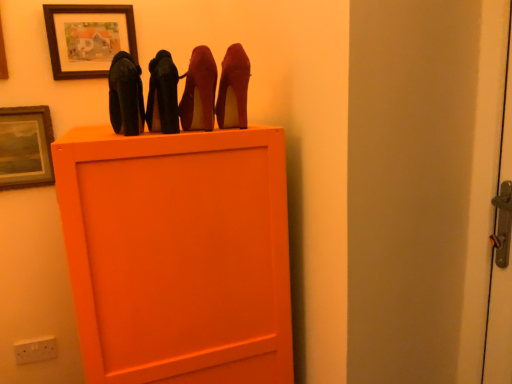
This screenshot has height=384, width=512. Find the location of `matte black high heels at upper center, the fourth high heels when ordered from right to left`. matte black high heels at upper center, the fourth high heels when ordered from right to left is located at coordinates (126, 95).

Describe the element at coordinates (199, 92) in the screenshot. The height and width of the screenshot is (384, 512). I see `shiny red high heels at upper center, acting as the 3th high heels starting from the left` at that location.

The image size is (512, 384). What do you see at coordinates (25, 147) in the screenshot? I see `wooden picture frame at upper left, the second picture frame viewed from the top` at bounding box center [25, 147].

This screenshot has height=384, width=512. What are the coordinates of `matte wooden picture frame at upper center, the 1th picture frame positioned from the top` in the screenshot? It's located at (88, 38).

Considering the sizes of white plastic electric outlet at lower left and matte wooden picture frame at upper center, the 1th picture frame in the right-to-left sequence, in the image, is white plastic electric outlet at lower left wider or thinner than matte wooden picture frame at upper center, the 1th picture frame in the right-to-left sequence,?

white plastic electric outlet at lower left is thinner than matte wooden picture frame at upper center, the 1th picture frame in the right-to-left sequence.

In the scene shown: Which object is closer to the camera taking this photo, white plastic electric outlet at lower left or matte wooden picture frame at upper center, which is counted as the 2th picture frame, starting from the left?

Positioned in front is matte wooden picture frame at upper center, which is counted as the 2th picture frame, starting from the left.

Which of these two, white plastic electric outlet at lower left or matte wooden picture frame at upper center, the 1th picture frame positioned from the top, is bigger?

Bigger between the two is matte wooden picture frame at upper center, the 1th picture frame positioned from the top.

From a real-world perspective, is white plastic electric outlet at lower left physically located above or below matte wooden picture frame at upper center, the 1th picture frame in the right-to-left sequence?

Clearly, from a real-world perspective, white plastic electric outlet at lower left is below matte wooden picture frame at upper center, the 1th picture frame in the right-to-left sequence.

From the picture: Is suede-like red high heels at upper center, acting as the fourth high heels starting from the left, smaller than matte wooden picture frame at upper center, which is counted as the 2th picture frame, starting from the left?

Actually, suede-like red high heels at upper center, acting as the fourth high heels starting from the left, might be larger than matte wooden picture frame at upper center, which is counted as the 2th picture frame, starting from the left.

Can you confirm if suede-like red high heels at upper center, acting as the fourth high heels starting from the left, is thinner than matte wooden picture frame at upper center, which is counted as the 2th picture frame, starting from the left?

Incorrect, the width of suede-like red high heels at upper center, acting as the fourth high heels starting from the left, is not less than that of matte wooden picture frame at upper center, which is counted as the 2th picture frame, starting from the left.

In the scene shown: From a real-world perspective, is suede-like red high heels at upper center, acting as the fourth high heels starting from the left, positioned under matte wooden picture frame at upper center, the 1th picture frame in the right-to-left sequence, based on gravity?

Indeed, from a real-world perspective, suede-like red high heels at upper center, acting as the fourth high heels starting from the left, is positioned beneath matte wooden picture frame at upper center, the 1th picture frame in the right-to-left sequence.

Is suede-like red high heels at upper center, acting as the fourth high heels starting from the left, at the right side of matte wooden picture frame at upper center, which is counted as the 2th picture frame, starting from the left?

Yes, suede-like red high heels at upper center, acting as the fourth high heels starting from the left, is to the right of matte wooden picture frame at upper center, which is counted as the 2th picture frame, starting from the left.

Is white plastic electric outlet at lower left smaller than shiny black high heels at center, the second high heels positioned from the left?

Yes, white plastic electric outlet at lower left is smaller than shiny black high heels at center, the second high heels positioned from the left.

How far apart are white plastic electric outlet at lower left and shiny black high heels at center, the second high heels positioned from the left?

A distance of 3.90 feet exists between white plastic electric outlet at lower left and shiny black high heels at center, the second high heels positioned from the left.

Is white plastic electric outlet at lower left not within shiny black high heels at center, acting as the third high heels starting from the right?

That's correct, white plastic electric outlet at lower left is outside of shiny black high heels at center, acting as the third high heels starting from the right.

Based on the photo, is the depth of white plastic electric outlet at lower left greater than that of shiny black high heels at center, acting as the third high heels starting from the right?

Yes, white plastic electric outlet at lower left is further from the camera.

Is suede-like red high heels at upper center, acting as the fourth high heels starting from the left, turned away from white plastic electric outlet at lower left?

No, suede-like red high heels at upper center, acting as the fourth high heels starting from the left,'s orientation is not away from white plastic electric outlet at lower left.

Are suede-like red high heels at upper center, acting as the fourth high heels starting from the left, and white plastic electric outlet at lower left making contact?

suede-like red high heels at upper center, acting as the fourth high heels starting from the left, is not next to white plastic electric outlet at lower left, and they're not touching.

From a real-world perspective, count 4th high heelss upward from the white plastic electric outlet at lower left and point to it. Please provide its 2D coordinates.

[(233, 89)]

From a real-world perspective, between matte black high heels at upper center, the 1th high heels viewed from the left, and matte wooden picture frame at upper center, which is the second picture frame in bottom-to-top order, who is vertically lower?

From a 3D spatial view, matte black high heels at upper center, the 1th high heels viewed from the left, is below.

Which is more to the left, matte black high heels at upper center, the 1th high heels viewed from the left, or matte wooden picture frame at upper center, the 1th picture frame positioned from the top?

matte wooden picture frame at upper center, the 1th picture frame positioned from the top, is more to the left.

From the image's perspective, is matte black high heels at upper center, the 1th high heels viewed from the left, over matte wooden picture frame at upper center, the 1th picture frame positioned from the top?

No.

Can you tell me how much white plastic electric outlet at lower left and shiny red high heels at upper center, the second high heels in the right-to-left sequence, differ in facing direction?

The facing directions of white plastic electric outlet at lower left and shiny red high heels at upper center, the second high heels in the right-to-left sequence, are 0.185 degrees apart.

Is white plastic electric outlet at lower left at the right side of shiny red high heels at upper center, the second high heels in the right-to-left sequence?

Incorrect, white plastic electric outlet at lower left is not on the right side of shiny red high heels at upper center, the second high heels in the right-to-left sequence.

From the image's perspective, between white plastic electric outlet at lower left and shiny red high heels at upper center, acting as the 3th high heels starting from the left, who is located below?

white plastic electric outlet at lower left, from the image's perspective.

Is white plastic electric outlet at lower left in contact with shiny red high heels at upper center, acting as the 3th high heels starting from the left?

white plastic electric outlet at lower left and shiny red high heels at upper center, acting as the 3th high heels starting from the left, are not in contact.

Based on the photo, considering the sizes of objects shiny black high heels at center, the second high heels positioned from the left, and white plastic electric outlet at lower left in the image provided, who is taller, shiny black high heels at center, the second high heels positioned from the left, or white plastic electric outlet at lower left?

With more height is shiny black high heels at center, the second high heels positioned from the left.

Which object is further away from the camera taking this photo, shiny black high heels at center, acting as the third high heels starting from the right, or white plastic electric outlet at lower left?

Positioned behind is white plastic electric outlet at lower left.

Is shiny black high heels at center, acting as the third high heels starting from the right, not inside white plastic electric outlet at lower left?

Yes, shiny black high heels at center, acting as the third high heels starting from the right, is not within white plastic electric outlet at lower left.

Who is smaller, shiny black high heels at center, acting as the third high heels starting from the right, or white plastic electric outlet at lower left?

white plastic electric outlet at lower left.

There is a white plastic electric outlet at lower left. Where is `the 2nd picture frame above it (from a real-world perspective)`? This screenshot has width=512, height=384. the 2nd picture frame above it (from a real-world perspective) is located at coordinates (88, 38).

At what (x,y) coordinates should I click in order to perform the action: click on the 1st picture frame counting from the left side of the suede-like red high heels at upper center, which appears as the first high heels when viewed from the right. Please return your answer as a coordinate pair (x, y). Looking at the image, I should click on (88, 38).

When comparing their distances from shiny red high heels at upper center, the second high heels in the right-to-left sequence, does suede-like red high heels at upper center, which appears as the first high heels when viewed from the right, or white plastic electric outlet at lower left seem closer?

suede-like red high heels at upper center, which appears as the first high heels when viewed from the right, lies closer to shiny red high heels at upper center, the second high heels in the right-to-left sequence, than the other object.

Based on their spatial positions, is wooden picture frame at upper left, the second picture frame viewed from the top, or matte wooden picture frame at upper center, the 1th picture frame in the right-to-left sequence, closer to white plastic electric outlet at lower left?

Based on the image, wooden picture frame at upper left, the second picture frame viewed from the top, appears to be nearer to white plastic electric outlet at lower left.

Looking at the image, which one is located closer to suede-like red high heels at upper center, acting as the fourth high heels starting from the left, matte wooden picture frame at upper center, the 1th picture frame positioned from the top, or white plastic electric outlet at lower left?

Based on the image, matte wooden picture frame at upper center, the 1th picture frame positioned from the top, appears to be nearer to suede-like red high heels at upper center, acting as the fourth high heels starting from the left.

Looking at this image, from the image, which object appears to be nearer to shiny red high heels at upper center, the second high heels in the right-to-left sequence, matte black high heels at upper center, the 1th high heels viewed from the left, or matte wooden picture frame at upper center, the 1th picture frame positioned from the top?

matte black high heels at upper center, the 1th high heels viewed from the left.

When comparing their distances from shiny black high heels at center, the second high heels positioned from the left, does suede-like red high heels at upper center, which appears as the first high heels when viewed from the right, or matte black high heels at upper center, the 1th high heels viewed from the left, seem further?

suede-like red high heels at upper center, which appears as the first high heels when viewed from the right, lies further to shiny black high heels at center, the second high heels positioned from the left, than the other object.

From the picture: Based on their spatial positions, is shiny red high heels at upper center, the second high heels in the right-to-left sequence, or wooden picture frame at upper left, which is the second picture frame from right to left, further from shiny black high heels at center, the second high heels positioned from the left?

wooden picture frame at upper left, which is the second picture frame from right to left.

Considering their positions, is matte black high heels at upper center, the fourth high heels when ordered from right to left, positioned closer to white plastic electric outlet at lower left than shiny red high heels at upper center, acting as the 3th high heels starting from the left?

Based on the image, matte black high heels at upper center, the fourth high heels when ordered from right to left, appears to be nearer to white plastic electric outlet at lower left.

From the image, which object appears to be farther from shiny black high heels at center, acting as the third high heels starting from the right, shiny red high heels at upper center, acting as the 3th high heels starting from the left, or suede-like red high heels at upper center, which appears as the first high heels when viewed from the right?

suede-like red high heels at upper center, which appears as the first high heels when viewed from the right, lies further to shiny black high heels at center, acting as the third high heels starting from the right, than the other object.

The image size is (512, 384). In order to click on picture frame that lies between matte wooden picture frame at upper center, the 1th picture frame positioned from the top, and white plastic electric outlet at lower left from top to bottom in this screenshot , I will do `click(25, 147)`.

Find the location of a particular element. The image size is (512, 384). picture frame situated between wooden picture frame at upper left, the 1th picture frame in the bottom-to-top sequence, and suede-like red high heels at upper center, which appears as the first high heels when viewed from the right, from left to right is located at coordinates (88, 38).

This screenshot has width=512, height=384. I want to click on electric outlet between wooden picture frame at upper left, the 1th picture frame in the bottom-to-top sequence, and suede-like red high heels at upper center, acting as the fourth high heels starting from the left, in the horizontal direction, so click(35, 349).

I want to click on picture frame located between wooden picture frame at upper left, the 1th picture frame in the bottom-to-top sequence, and matte black high heels at upper center, the 1th high heels viewed from the left, in the left-right direction, so click(x=88, y=38).